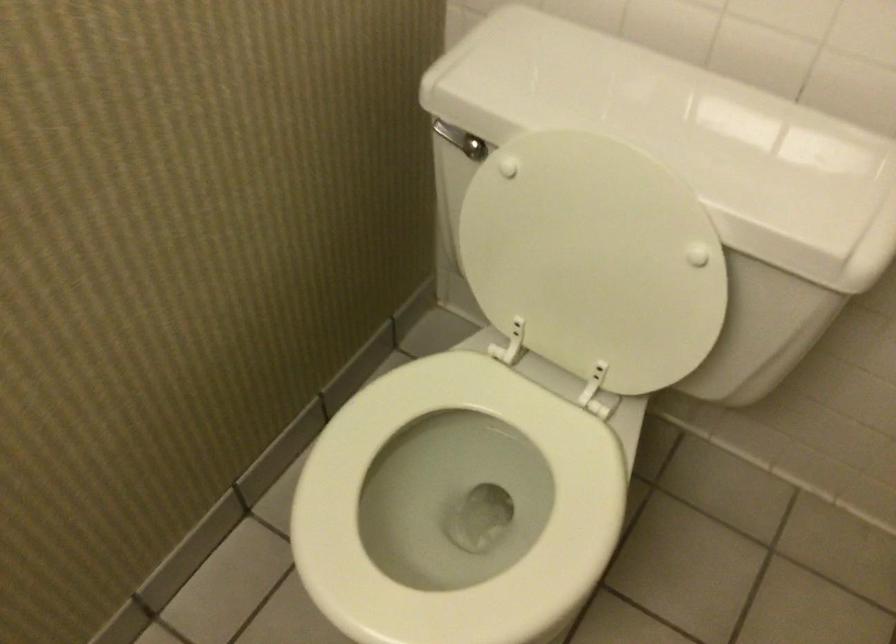
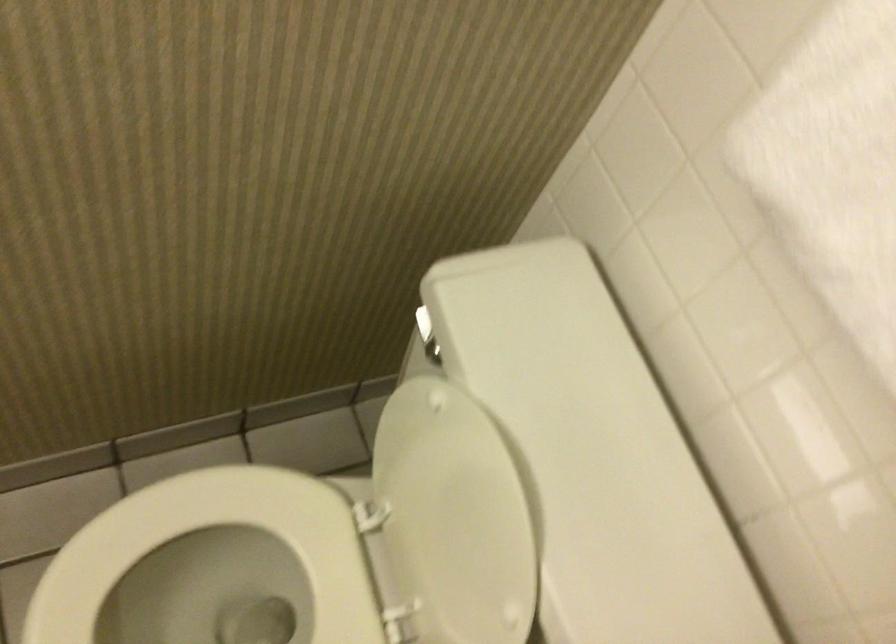
Question: The camera is either moving clockwise (left) or counter-clockwise (right) around the object. The first image is from the beginning of the video and the second image is from the end. Is the camera moving left or right when shooting the video?

Choices:
 (A) Left
 (B) Right

Answer: (B)